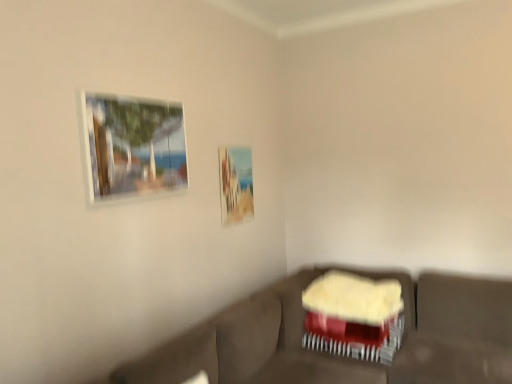
The height and width of the screenshot is (384, 512). I want to click on matte glass picture frame at upper left, the second picture frame when ordered from back to front, so click(133, 146).

The width and height of the screenshot is (512, 384). What do you see at coordinates (133, 146) in the screenshot?
I see `matte glass picture frame at upper left, the 1th picture frame positioned from the front` at bounding box center [133, 146].

The image size is (512, 384). In order to click on velvet red swivel chair at lower right in this screenshot , I will do `click(354, 317)`.

The width and height of the screenshot is (512, 384). What are the coordinates of `matte glass picture frame at upper left, the 1th picture frame positioned from the front` in the screenshot? It's located at (133, 146).

Is point (384, 338) closer or farther from the camera than point (174, 122)?

Clearly, point (384, 338) is more distant from the camera than point (174, 122).

In the image, is velvet red swivel chair at lower right on the left side or the right side of matte glass picture frame at upper left, the second picture frame positioned from the right?

Clearly, velvet red swivel chair at lower right is on the right of matte glass picture frame at upper left, the second picture frame positioned from the right, in the image.

Is velvet red swivel chair at lower right directly adjacent to matte glass picture frame at upper left, the second picture frame positioned from the right?

No, velvet red swivel chair at lower right is not making contact with matte glass picture frame at upper left, the second picture frame positioned from the right.

Do you think velvet red swivel chair at lower right is within matte glass picture frame at upper left, the 1th picture frame positioned from the left, or outside of it?

velvet red swivel chair at lower right is located beyond the bounds of matte glass picture frame at upper left, the 1th picture frame positioned from the left.

Considering their positions, is velvet brown couch at lower center located in front of or behind velvet red swivel chair at lower right?

In the image, velvet brown couch at lower center appears in front of velvet red swivel chair at lower right.

Measure the distance between velvet brown couch at lower center and velvet red swivel chair at lower right.

10.54 inches.

Is velvet brown couch at lower center smaller than velvet red swivel chair at lower right?

Actually, velvet brown couch at lower center might be larger than velvet red swivel chair at lower right.

Is velvet brown couch at lower center wider or thinner than velvet red swivel chair at lower right?

In the image, velvet brown couch at lower center appears to be wider than velvet red swivel chair at lower right.

Does velvet red swivel chair at lower right appear on the left side of matte wooden picture frame at upper center, which is the second picture frame in front-to-back order?

In fact, velvet red swivel chair at lower right is to the right of matte wooden picture frame at upper center, which is the second picture frame in front-to-back order.

Is velvet red swivel chair at lower right positioned with its back to matte wooden picture frame at upper center, acting as the 1th picture frame starting from the back?

velvet red swivel chair at lower right does not have its back to matte wooden picture frame at upper center, acting as the 1th picture frame starting from the back.

Does point (378, 307) come in front of point (229, 186)?

Yes, point (378, 307) is closer to viewer.

From a real-world perspective, is matte wooden picture frame at upper center, which is the second picture frame in front-to-back order, beneath velvet brown couch at lower center?

Incorrect, from a real-world perspective, matte wooden picture frame at upper center, which is the second picture frame in front-to-back order, is higher than velvet brown couch at lower center.

Between matte wooden picture frame at upper center, the first picture frame positioned from the right, and velvet brown couch at lower center, which one has larger size?

velvet brown couch at lower center.

Could you tell me if matte wooden picture frame at upper center, the first picture frame positioned from the right, is turned towards velvet brown couch at lower center?

No, matte wooden picture frame at upper center, the first picture frame positioned from the right, is not facing towards velvet brown couch at lower center.

Measure the distance between matte wooden picture frame at upper center, the first picture frame positioned from the right, and matte glass picture frame at upper left, the 1th picture frame positioned from the left.

31.16 inches.

From the image's perspective, who appears lower, matte wooden picture frame at upper center, acting as the 1th picture frame starting from the back, or matte glass picture frame at upper left, the second picture frame when ordered from back to front?

matte wooden picture frame at upper center, acting as the 1th picture frame starting from the back, is shown below in the image.

Is matte wooden picture frame at upper center, the first picture frame positioned from the right, wider or thinner than matte glass picture frame at upper left, the 1th picture frame positioned from the front?

→ matte wooden picture frame at upper center, the first picture frame positioned from the right, is thinner than matte glass picture frame at upper left, the 1th picture frame positioned from the front.

From a real-world perspective, is matte wooden picture frame at upper center, which is the second picture frame in front-to-back order, positioned over matte glass picture frame at upper left, the second picture frame when ordered from back to front, based on gravity?

No, from a real-world perspective, matte wooden picture frame at upper center, which is the second picture frame in front-to-back order, is not over matte glass picture frame at upper left, the second picture frame when ordered from back to front

Looking at this image, is matte glass picture frame at upper left, the second picture frame positioned from the right, completely or partially outside of matte wooden picture frame at upper center, the second picture frame viewed from the left?

matte glass picture frame at upper left, the second picture frame positioned from the right, lies outside matte wooden picture frame at upper center, the second picture frame viewed from the left,'s area.

Based on the photo, considering the sizes of objects matte glass picture frame at upper left, the 1th picture frame positioned from the left, and matte wooden picture frame at upper center, the first picture frame positioned from the right, in the image provided, who is thinner, matte glass picture frame at upper left, the 1th picture frame positioned from the left, or matte wooden picture frame at upper center, the first picture frame positioned from the right,?

matte wooden picture frame at upper center, the first picture frame positioned from the right, is thinner.

Can you tell me how much matte glass picture frame at upper left, the second picture frame positioned from the right, and matte wooden picture frame at upper center, acting as the 1th picture frame starting from the back, differ in facing direction?

0.000886 degrees separate the facing orientations of matte glass picture frame at upper left, the second picture frame positioned from the right, and matte wooden picture frame at upper center, acting as the 1th picture frame starting from the back.

Looking at the image, does matte glass picture frame at upper left, the 1th picture frame positioned from the front, seem bigger or smaller compared to matte wooden picture frame at upper center, the second picture frame viewed from the left?

Clearly, matte glass picture frame at upper left, the 1th picture frame positioned from the front, is larger in size than matte wooden picture frame at upper center, the second picture frame viewed from the left.

Is velvet red swivel chair at lower right oriented towards velvet brown couch at lower center?

Yes, velvet red swivel chair at lower right faces towards velvet brown couch at lower center.

Considering the relative positions of velvet red swivel chair at lower right and velvet brown couch at lower center in the image provided, is velvet red swivel chair at lower right to the left of velvet brown couch at lower center from the viewer's perspective?

In fact, velvet red swivel chair at lower right is to the right of velvet brown couch at lower center.

From the image's perspective, would you say velvet red swivel chair at lower right is shown under velvet brown couch at lower center?

Incorrect, from the image's perspective, velvet red swivel chair at lower right is higher than velvet brown couch at lower center.

Based on the photo, which object is further away from the camera taking this photo, velvet red swivel chair at lower right or velvet brown couch at lower center?

velvet red swivel chair at lower right is behind.

Where is `swivel chair behind the matte glass picture frame at upper left, the 1th picture frame positioned from the left`? swivel chair behind the matte glass picture frame at upper left, the 1th picture frame positioned from the left is located at coordinates (354, 317).

You are a GUI agent. You are given a task and a screenshot of the screen. Output one action in this format:
    pyautogui.click(x=<x>, y=<y>)
    Task: Click on the studio couch in front of the velvet red swivel chair at lower right
    This screenshot has width=512, height=384.
    Given the screenshot: What is the action you would take?
    click(339, 357)

Which object lies nearer to the anchor point matte glass picture frame at upper left, the 1th picture frame positioned from the front, velvet red swivel chair at lower right or velvet brown couch at lower center?

Based on the image, velvet brown couch at lower center appears to be nearer to matte glass picture frame at upper left, the 1th picture frame positioned from the front.

Looking at the image, which one is located further to velvet brown couch at lower center, matte glass picture frame at upper left, the second picture frame when ordered from back to front, or velvet red swivel chair at lower right?

Based on the image, matte glass picture frame at upper left, the second picture frame when ordered from back to front, appears to be further to velvet brown couch at lower center.

Looking at this image, from the image, which object appears to be farther from matte glass picture frame at upper left, the second picture frame positioned from the right, velvet red swivel chair at lower right or matte wooden picture frame at upper center, which is the second picture frame in front-to-back order?

velvet red swivel chair at lower right is further to matte glass picture frame at upper left, the second picture frame positioned from the right.

Based on the photo, based on their spatial positions, is velvet red swivel chair at lower right or matte glass picture frame at upper left, the second picture frame when ordered from back to front, closer to velvet brown couch at lower center?

velvet red swivel chair at lower right lies closer to velvet brown couch at lower center than the other object.

From the image, which object appears to be farther from velvet red swivel chair at lower right, matte glass picture frame at upper left, the 1th picture frame positioned from the left, or matte wooden picture frame at upper center, which is the second picture frame in front-to-back order?

matte glass picture frame at upper left, the 1th picture frame positioned from the left, is positioned further to the anchor velvet red swivel chair at lower right.

Based on their spatial positions, is matte wooden picture frame at upper center, acting as the 1th picture frame starting from the back, or velvet brown couch at lower center closer to matte glass picture frame at upper left, the 1th picture frame positioned from the left?

Based on the image, matte wooden picture frame at upper center, acting as the 1th picture frame starting from the back, appears to be nearer to matte glass picture frame at upper left, the 1th picture frame positioned from the left.

Estimate the real-world distances between objects in this image. Which object is further from velvet red swivel chair at lower right, velvet brown couch at lower center or matte glass picture frame at upper left, the second picture frame positioned from the right?

The object further to velvet red swivel chair at lower right is matte glass picture frame at upper left, the second picture frame positioned from the right.

Based on their spatial positions, is velvet brown couch at lower center or matte glass picture frame at upper left, the 1th picture frame positioned from the left, closer to matte wooden picture frame at upper center, acting as the 1th picture frame starting from the back?

matte glass picture frame at upper left, the 1th picture frame positioned from the left, is closer to matte wooden picture frame at upper center, acting as the 1th picture frame starting from the back.

The width and height of the screenshot is (512, 384). Identify the location of picture frame situated between matte glass picture frame at upper left, the 1th picture frame positioned from the front, and velvet red swivel chair at lower right from left to right. (234, 184).

The width and height of the screenshot is (512, 384). In order to click on swivel chair between velvet brown couch at lower center and matte wooden picture frame at upper center, the second picture frame viewed from the left, along the z-axis in this screenshot , I will do `click(354, 317)`.

I want to click on picture frame between velvet brown couch at lower center and matte wooden picture frame at upper center, the second picture frame viewed from the left, along the z-axis, so click(x=133, y=146).

The height and width of the screenshot is (384, 512). I want to click on picture frame between velvet brown couch at lower center and velvet red swivel chair at lower right along the z-axis, so click(133, 146).